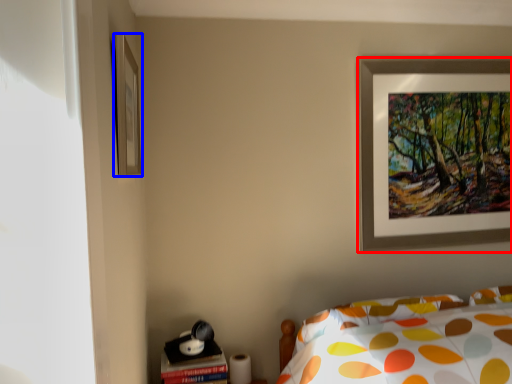
Question: Which point is closer to the camera, picture frame (highlighted by a red box) or picture frame (highlighted by a blue box)?

Choices:
 (A) picture frame
 (B) picture frame

Answer: (B)